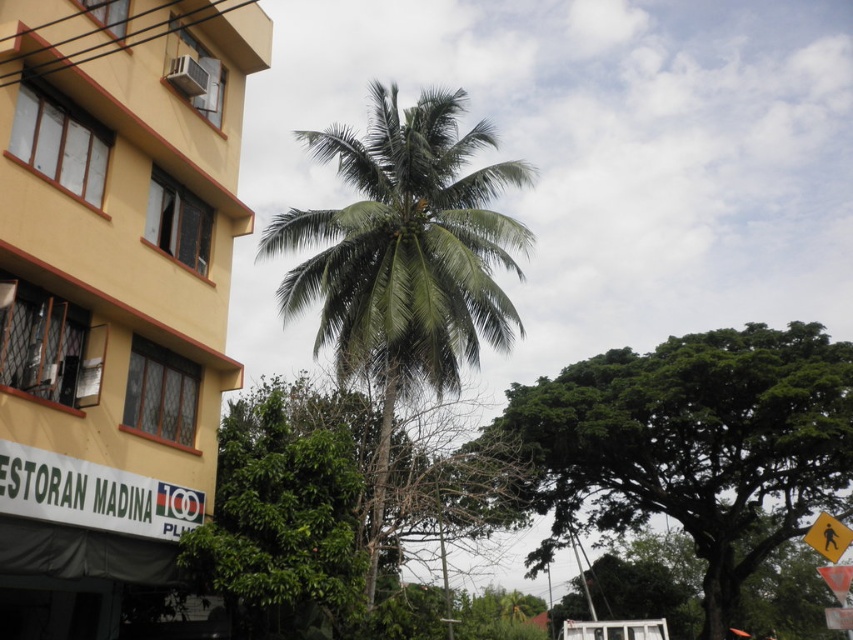
Who is higher up, yellow matte building at left or green leafy palm tree at center?

yellow matte building at left is higher up.

Can you confirm if yellow matte building at left is positioned above green leafy palm tree at center?

Yes, yellow matte building at left is above green leafy palm tree at center.

Describe the element at coordinates (113, 291) in the screenshot. I see `yellow matte building at left` at that location.

Find the location of a particular element. yellow matte building at left is located at coordinates (113, 291).

Between green leafy palm tree at center and yellow reflective pedestrian crossing sign at lower right, which one appears on the right side from the viewer's perspective?

yellow reflective pedestrian crossing sign at lower right is more to the right.

Does green leafy palm tree at center have a lesser width compared to yellow reflective pedestrian crossing sign at lower right?

No, green leafy palm tree at center is not thinner than yellow reflective pedestrian crossing sign at lower right.

Describe the element at coordinates (404, 257) in the screenshot. I see `green leafy palm tree at center` at that location.

Find the location of `green leafy palm tree at center`. green leafy palm tree at center is located at coordinates (404, 257).

Is green leafy tree at center closer to camera compared to green leafy palm tree at center?

No, it is behind green leafy palm tree at center.

Who is more distant from viewer, [683,365] or [380,179]?

Positioned behind is point [683,365].

Where is `green leafy tree at center`? This screenshot has width=853, height=640. green leafy tree at center is located at coordinates (689, 445).